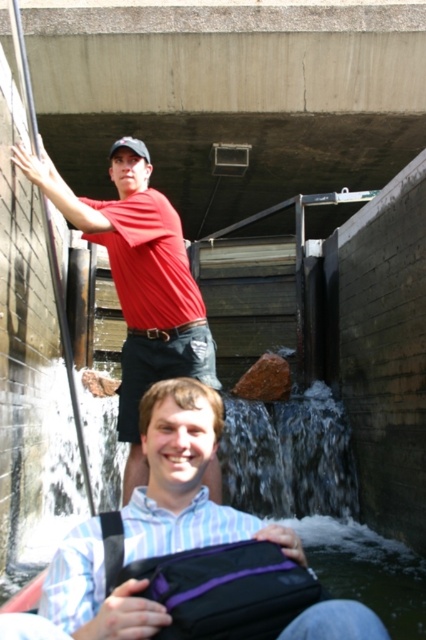
You are a photographer trying to capture a photo of the clear water at center and the matte red shirt at upper left. Based on their positions, which object is closer to the right side of the image?

The clear water at center is to the right of the matte red shirt at upper left, so the clear water at center is closer to the right side of the image.

You are a photographer wanting to capture a reflection of the matte black baseball cap at upper center in the clear water at center. Based on the scene, can you determine if the reflection will be visible?

The clear water at center is in front of matte black baseball cap at upper center, so the reflection of the matte black baseball cap at upper center would not be visible in the clear water at center since the cap is behind the water from the observer perspective.